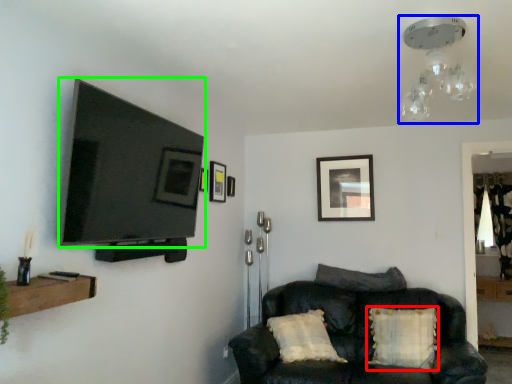
Question: Based on their relative distances, which object is farther from pillow (highlighted by a red box)? Choose from light fixture (highlighted by a blue box) and television (highlighted by a green box).

Choices:
 (A) light fixture
 (B) television

Answer: (B)